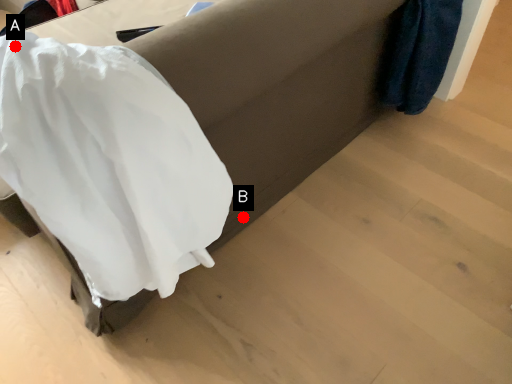
Question: Two points are circled on the image, labeled by A and B beside each circle. Which point is farther to the camera?

Choices:
 (A) A is further
 (B) B is further

Answer: (B)